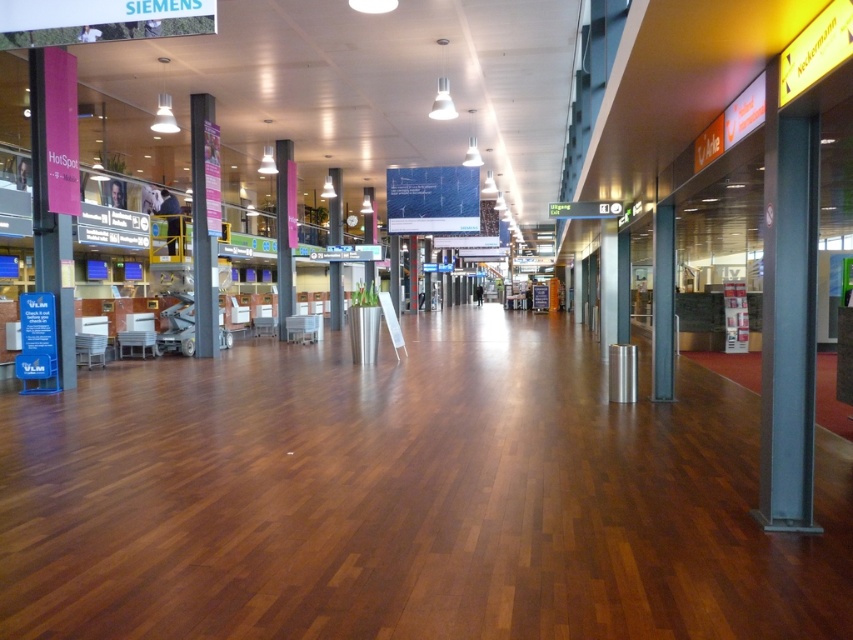
The width and height of the screenshot is (853, 640). What do you see at coordinates (202, 232) in the screenshot?
I see `metallic gray pillar at center` at bounding box center [202, 232].

Can you confirm if metallic gray pillar at center is taller than metallic gray pillar at center-right?

Yes, metallic gray pillar at center is taller than metallic gray pillar at center-right.

Which is behind, point (215, 285) or point (660, 284)?

The point (215, 285) is behind.

The image size is (853, 640). What are the coordinates of `metallic gray pillar at center` in the screenshot? It's located at (202, 232).